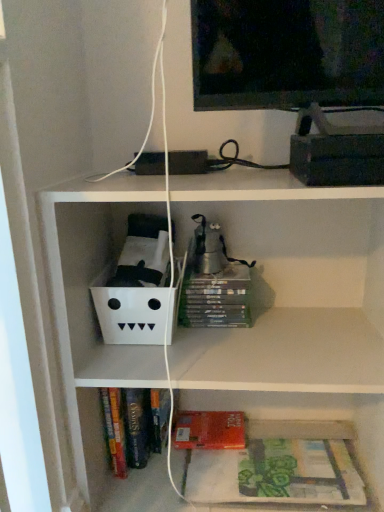
Where is `hardcover books at lower center`? This screenshot has height=512, width=384. hardcover books at lower center is located at coordinates (320, 419).

Is hardcover books at lower center next to green matte book at lower right and touching it?

hardcover books at lower center is not next to green matte book at lower right, and they're not touching.

Locate an element on the screen. Image resolution: width=384 pixels, height=512 pixels. shelf lying below the green matte book at lower right (from the image's perspective) is located at coordinates tap(320, 419).

Is hardcover books at lower center positioned with its back to green matte book at lower right?

That's not correct — hardcover books at lower center is not looking away from green matte book at lower right.

Is hardcover books at lower center smaller than green matte book at lower right?

Incorrect, hardcover books at lower center is not smaller in size than green matte book at lower right.

Does hardcover books at lower center appear on the right side of red matte paperback book at lower center?

Yes, hardcover books at lower center is to the right of red matte paperback book at lower center.

Is hardcover books at lower center next to red matte paperback book at lower center?

No.

How different are the orientations of hardcover books at lower center and red matte paperback book at lower center in degrees?

The angular difference between hardcover books at lower center and red matte paperback book at lower center is 179 degrees.

You are a GUI agent. You are given a task and a screenshot of the screen. Output one action in this format:
    pyautogui.click(x=<x>, y=<y>)
    Task: Click on the shelf below the red matte paperback book at lower center (from a real-world perspective)
    The width and height of the screenshot is (384, 512).
    Given the screenshot: What is the action you would take?
    pyautogui.click(x=320, y=419)

Does red matte paperback book at lower center turn towards green matte book at lower right?

No, red matte paperback book at lower center is not turned towards green matte book at lower right.

Does red matte paperback book at lower center appear on the right side of green matte book at lower right?

No, red matte paperback book at lower center is not to the right of green matte book at lower right.

Between red matte paperback book at lower center and green matte book at lower right, which one has smaller width?

red matte paperback book at lower center is thinner.

At what (x,y) coordinates should I click in order to perform the action: click on book to the right of red matte paperback book at lower center. Please return your answer as a coordinate pair (x, y). Image resolution: width=384 pixels, height=512 pixels. Looking at the image, I should click on (299, 472).

Considering the sizes of green matte book at lower right and hardcover books at lower center in the image, is green matte book at lower right wider or thinner than hardcover books at lower center?

Considering their sizes, green matte book at lower right looks slimmer than hardcover books at lower center.

Is green matte book at lower right in front of or behind hardcover books at lower center in the image?

green matte book at lower right is behind hardcover books at lower center.

Based on the photo, how many degrees apart are the facing directions of green matte book at lower right and hardcover books at lower center?

There is a 179-degree angle between the facing directions of green matte book at lower right and hardcover books at lower center.

Is the position of red matte paperback book at lower center less distant than that of hardcover books at lower center?

That is False.

Is red matte paperback book at lower center taller or shorter than hardcover books at lower center?

Clearly, red matte paperback book at lower center is shorter compared to hardcover books at lower center.

Looking at this image, is hardcover books at lower center at the back of red matte paperback book at lower center?

No, hardcover books at lower center is not at the back of red matte paperback book at lower center.

In the image, there is a red matte paperback book at lower center. Where is `shelf below it (from a real-world perspective)`? The height and width of the screenshot is (512, 384). shelf below it (from a real-world perspective) is located at coordinates (320, 419).

Is green matte book at lower right aimed at red matte paperback book at lower center?

No, green matte book at lower right is not aimed at red matte paperback book at lower center.

From a real-world perspective, which object rests below the other?

red matte paperback book at lower center, from a real-world perspective.

Which point is more forward, (296, 470) or (192, 438)?

The point (296, 470) is closer to the camera.

You are a GUI agent. You are given a task and a screenshot of the screen. Output one action in this format:
    pyautogui.click(x=<x>, y=<y>)
    Task: Click on the book located on the right of hardcover books at lower center
    
    Given the screenshot: What is the action you would take?
    pyautogui.click(x=299, y=472)

Identify the location of paperback book on the left of the hardcover books at lower center. pos(210,430).

Based on their spatial positions, is hardcover books at lower center or green matte book at lower right closer to red matte paperback book at lower center?

hardcover books at lower center lies closer to red matte paperback book at lower center than the other object.

Estimate the real-world distances between objects in this image. Which object is closer to green matte book at lower right, hardcover books at lower center or red matte paperback book at lower center?

Among the two, hardcover books at lower center is located nearer to green matte book at lower right.

Considering their positions, is red matte paperback book at lower center positioned further to green matte book at lower right than hardcover books at lower center?

Among the two, red matte paperback book at lower center is located further to green matte book at lower right.

When comparing their distances from red matte paperback book at lower center, does green matte book at lower right or hardcover books at lower center seem closer?

hardcover books at lower center lies closer to red matte paperback book at lower center than the other object.

Considering their positions, is green matte book at lower right positioned further to hardcover books at lower center than red matte paperback book at lower center?

The object further to hardcover books at lower center is red matte paperback book at lower center.

When comparing their distances from hardcover books at lower center, does red matte paperback book at lower center or green matte book at lower right seem further?

red matte paperback book at lower center is positioned further to the anchor hardcover books at lower center.

At what (x,y) coordinates should I click in order to perform the action: click on book between hardcover books at lower center and red matte paperback book at lower center in the front-back direction. Please return your answer as a coordinate pair (x, y). The width and height of the screenshot is (384, 512). Looking at the image, I should click on (299, 472).